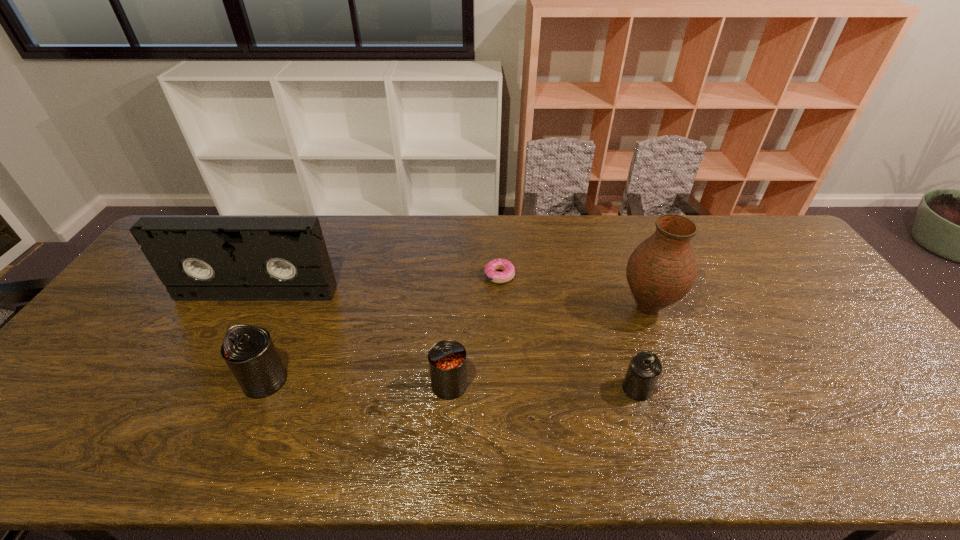
Find the location of a particular element. Image resolution: width=960 pixels, height=540 pixels. free space that satisfies the following two spatial constraints: 1. on the front side of the vase; 2. on the right side of the doughnut is located at coordinates (501, 308).

Image resolution: width=960 pixels, height=540 pixels. I want to click on vacant space that satisfies the following two spatial constraints: 1. on the back side of the tallest can; 2. on the right side of the vase, so click(296, 308).